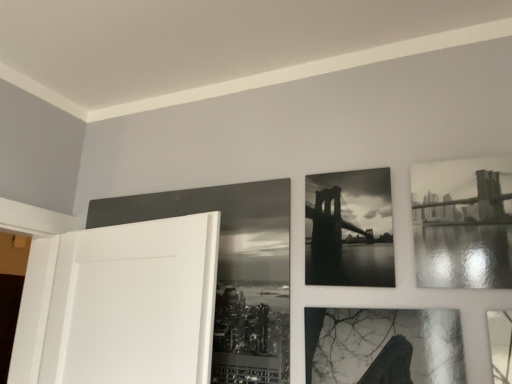
Question: From the image's perspective, is black glossy picture frame at upper center, positioned as the first picture frame in left-to-right order, below black glossy photo frame at center, the 2th picture frame positioned from the right?

Choices:
 (A) no
 (B) yes

Answer: (B)

Question: Is black glossy picture frame at upper center, positioned as the first picture frame in left-to-right order, next to black glossy photo frame at center, the 2th picture frame positioned from the right, and touching it?

Choices:
 (A) no
 (B) yes

Answer: (A)

Question: Does black glossy picture frame at upper center, positioned as the first picture frame in left-to-right order, have a greater height compared to black glossy photo frame at center, the 2th picture frame positioned from the right?

Choices:
 (A) yes
 (B) no

Answer: (A)

Question: From a real-world perspective, is black glossy picture frame at upper center, positioned as the first picture frame in left-to-right order, physically above black glossy photo frame at center, the 2th picture frame positioned from the right?

Choices:
 (A) no
 (B) yes

Answer: (A)

Question: Can you confirm if black glossy picture frame at upper center, positioned as the first picture frame in left-to-right order, is wider than black glossy photo frame at center, the 2th picture frame positioned from the right?

Choices:
 (A) yes
 (B) no

Answer: (B)

Question: Looking at their shapes, would you say black glossy picture frame at upper center, placed as the third picture frame when sorted from right to left, is wider or thinner than black glossy photo frame at center, which is the second picture frame in left-to-right order?

Choices:
 (A) thin
 (B) wide

Answer: (A)

Question: Is black glossy picture frame at upper center, positioned as the first picture frame in left-to-right order, to the left or to the right of black glossy photo frame at center, the 2th picture frame positioned from the right, in the image?

Choices:
 (A) right
 (B) left

Answer: (B)

Question: Is point (280, 360) positioned closer to the camera than point (370, 180)?

Choices:
 (A) closer
 (B) farther

Answer: (A)

Question: From their relative heights in the image, would you say black glossy picture frame at upper center, placed as the third picture frame when sorted from right to left, is taller or shorter than black glossy photo frame at center, which is the second picture frame in left-to-right order?

Choices:
 (A) short
 (B) tall

Answer: (B)

Question: From a real-world perspective, relative to black glossy picture frame at upper center, placed as the third picture frame when sorted from right to left, is black glossy photo frame at upper right, which is the 1th picture frame in right-to-left order, vertically above or below?

Choices:
 (A) above
 (B) below

Answer: (A)

Question: Is black glossy photo frame at upper right, which ranks as the 3th picture frame in left-to-right order, bigger or smaller than black glossy picture frame at upper center, positioned as the first picture frame in left-to-right order?

Choices:
 (A) big
 (B) small

Answer: (B)

Question: In terms of height, does black glossy photo frame at upper right, which is the 1th picture frame in right-to-left order, look taller or shorter compared to black glossy picture frame at upper center, placed as the third picture frame when sorted from right to left?

Choices:
 (A) short
 (B) tall

Answer: (A)

Question: Considering the positions of black glossy photo frame at upper right, which is the 1th picture frame in right-to-left order, and black glossy picture frame at upper center, positioned as the first picture frame in left-to-right order, in the image, is black glossy photo frame at upper right, which is the 1th picture frame in right-to-left order, wider or thinner than black glossy picture frame at upper center, positioned as the first picture frame in left-to-right order,?

Choices:
 (A) wide
 (B) thin

Answer: (A)

Question: Is black glossy photo frame at center, which is the second picture frame in left-to-right order, taller or shorter than black glossy picture frame at upper center, positioned as the first picture frame in left-to-right order?

Choices:
 (A) short
 (B) tall

Answer: (A)

Question: From a real-world perspective, is black glossy photo frame at center, the 2th picture frame positioned from the right, physically located above or below black glossy picture frame at upper center, placed as the third picture frame when sorted from right to left?

Choices:
 (A) below
 (B) above

Answer: (B)